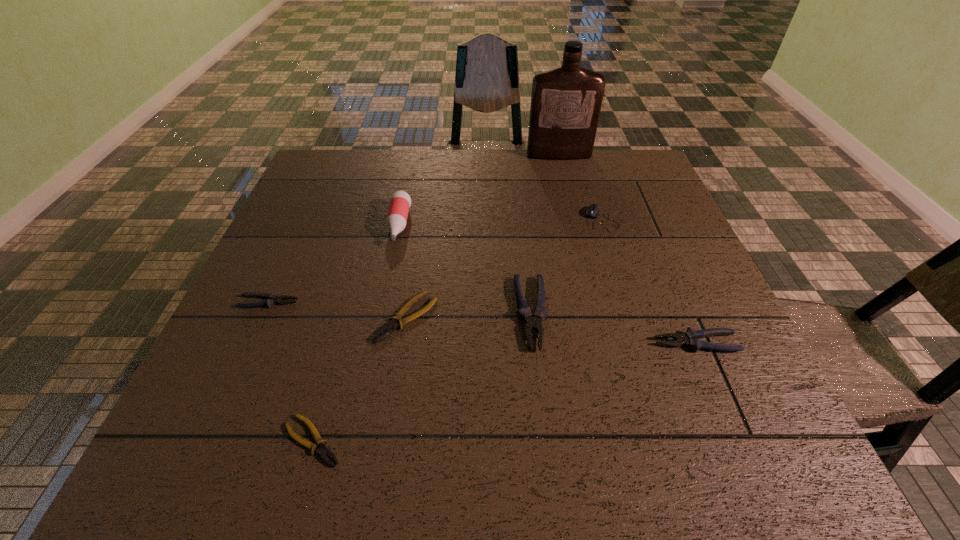
Where is `the farthest object`? The image size is (960, 540). the farthest object is located at coordinates (566, 102).

You are a GUI agent. You are given a task and a screenshot of the screen. Output one action in this format:
    pyautogui.click(x=<x>, y=<y>)
    Task: Click on the tallest object
    Image resolution: width=960 pixels, height=540 pixels.
    Given the screenshot: What is the action you would take?
    pyautogui.click(x=566, y=102)

The height and width of the screenshot is (540, 960). I want to click on the seventh shortest object, so 400,202.

You are a GUI agent. You are given a task and a screenshot of the screen. Output one action in this format:
    pyautogui.click(x=<x>, y=<y>)
    Task: Click on the pink bottle
    
    Given the screenshot: What is the action you would take?
    pyautogui.click(x=400, y=202)

Where is `the second gray pliers from right to left`? the second gray pliers from right to left is located at coordinates (532, 323).

The image size is (960, 540). Identify the location of the fourth object from right to left. (532, 323).

Where is `computer mouse`? The image size is (960, 540). computer mouse is located at coordinates pos(592,211).

Where is `the second biggest gray pliers`? the second biggest gray pliers is located at coordinates (690, 338).

Locate an element on the screen. The image size is (960, 540). the fourth shortest pliers is located at coordinates (690, 338).

The image size is (960, 540). I want to click on the leftmost object, so [271, 299].